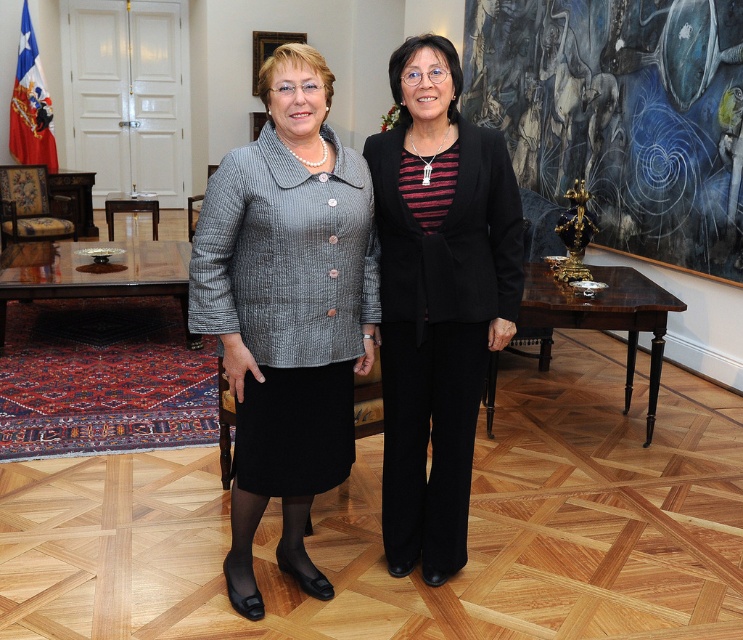
Question: Can you confirm if metallic gold sculpture at right is bigger than black textured pants at center?

Choices:
 (A) yes
 (B) no

Answer: (A)

Question: Which point is farther to the camera?

Choices:
 (A) matte gray blazer at center
 (B) metallic gold sculpture at right

Answer: (B)

Question: Is matte gray blazer at center closer to the viewer compared to black textured pants at center?

Choices:
 (A) no
 (B) yes

Answer: (B)

Question: Which of these objects is positioned farthest from the metallic gold sculpture at right?

Choices:
 (A) matte gray blazer at center
 (B) black textured pants at center

Answer: (A)

Question: Which point is farther from the camera taking this photo?

Choices:
 (A) (438, 426)
 (B) (241, 605)

Answer: (A)

Question: Is matte gray blazer at center smaller than black textured pants at center?

Choices:
 (A) no
 (B) yes

Answer: (B)